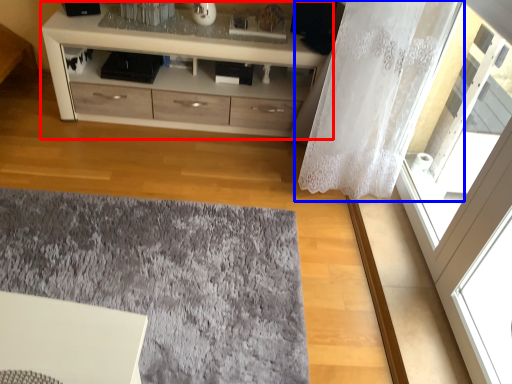
Question: Which of the following is the closest to the observer, chest of drawers (highlighted by a red box) or curtain (highlighted by a blue box)?

Choices:
 (A) chest of drawers
 (B) curtain

Answer: (B)